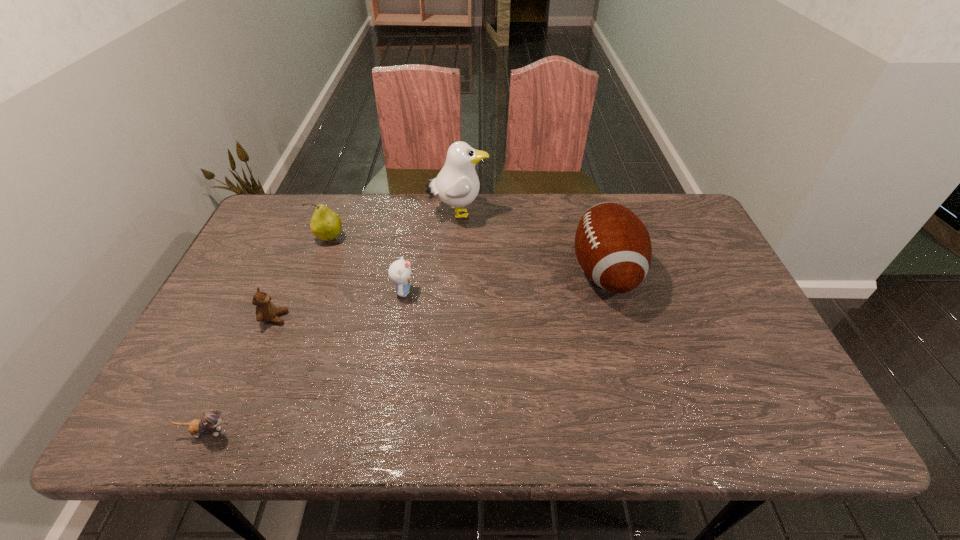
This screenshot has height=540, width=960. I want to click on pear located at the far edge, so click(325, 224).

Where is `object at the near edge`? This screenshot has height=540, width=960. object at the near edge is located at coordinates (211, 419).

This screenshot has height=540, width=960. Find the location of `teddy bear that is at the left edge`. teddy bear that is at the left edge is located at coordinates (265, 310).

The width and height of the screenshot is (960, 540). What are the coordinates of `kitten present at the left edge` in the screenshot? It's located at (211, 419).

Locate an element on the screen. This screenshot has width=960, height=540. object at the near left corner is located at coordinates (211, 419).

Identify the location of vacant space at the far edge. The height and width of the screenshot is (540, 960). (473, 212).

Identify the location of vacant space at the left edge of the desktop. (243, 346).

Identify the location of vacant area at the right edge of the desktop. (697, 320).

The width and height of the screenshot is (960, 540). I want to click on vacant region at the far left corner, so click(x=272, y=239).

Where is `vacant space at the near left corner`? The image size is (960, 540). vacant space at the near left corner is located at coordinates (184, 406).